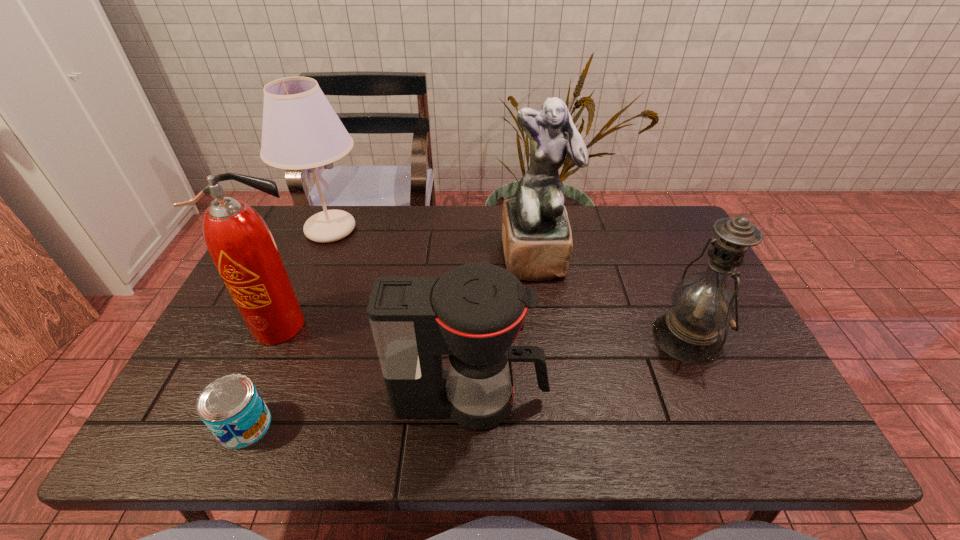
Point out which object is positioned as the nearest to the oil lamp. Please provide its 2D coordinates. Your answer should be formatted as a tuple, i.e. [(x, y)], where the tuple contains the x and y coordinates of a point satisfying the conditions above.

[(537, 241)]

Identify which object is located as the nearest to the shortest object. Please provide its 2D coordinates. Your answer should be formatted as a tuple, i.e. [(x, y)], where the tuple contains the x and y coordinates of a point satisfying the conditions above.

[(241, 245)]

Locate an element on the screen. Image resolution: width=960 pixels, height=540 pixels. free space in the image that satisfies the following two spatial constraints: 1. pour from the carafe of the coffee maker; 2. on the front side of the shortest object is located at coordinates (470, 426).

This screenshot has height=540, width=960. Identify the location of vacant space that satisfies the following two spatial constraints: 1. in a relaxed pose on the sculpture; 2. on the right side of the oil lamp. (547, 337).